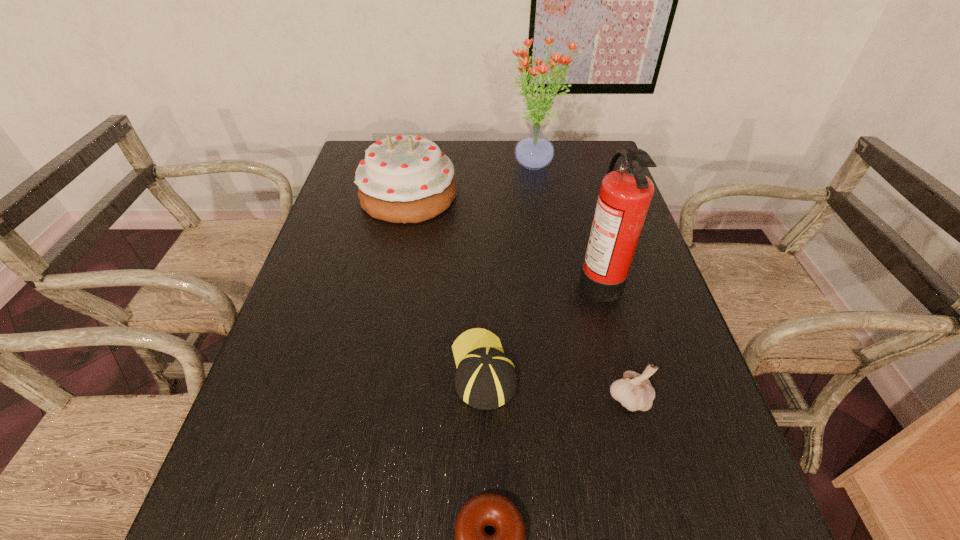
You are a GUI agent. You are given a task and a screenshot of the screen. Output one action in this format:
    pyautogui.click(x=<x>, y=<y>)
    Task: Click on the vacant region between the fourth shortest object and the flower arrangement
    
    Given the screenshot: What is the action you would take?
    pyautogui.click(x=472, y=180)

This screenshot has width=960, height=540. I want to click on free point between the baseball cap and the flower arrangement, so click(510, 267).

This screenshot has height=540, width=960. Identify the location of free area in between the baseball cap and the flower arrangement. (510, 267).

You are a GUI agent. You are given a task and a screenshot of the screen. Output one action in this format:
    pyautogui.click(x=<x>, y=<y>)
    Task: Click on the empty space between the leftmost object and the flower arrangement
    
    Given the screenshot: What is the action you would take?
    pyautogui.click(x=472, y=180)

Identify which object is located as the fifth nearest to the fourth tallest object. Please provide its 2D coordinates. Your answer should be formatted as a tuple, i.e. [(x, y)], where the tuple contains the x and y coordinates of a point satisfying the conditions above.

[(534, 151)]

Point out which object is positioned as the second nearest to the fourth nearest object. Please provide its 2D coordinates. Your answer should be formatted as a tuple, i.e. [(x, y)], where the tuple contains the x and y coordinates of a point satisfying the conditions above.

[(635, 392)]

The width and height of the screenshot is (960, 540). Identify the location of free spot that satisfies the following two spatial constraints: 1. on the front-facing side of the fire extinguisher; 2. on the front side of the fourth tallest object. (631, 398).

The image size is (960, 540). I want to click on blank space that satisfies the following two spatial constraints: 1. on the front-facing side of the fourth nearest object; 2. on the front side of the garlic, so click(631, 398).

Identify the location of free spot that satisfies the following two spatial constraints: 1. on the front side of the third shortest object; 2. on the right side of the leftmost object. The width and height of the screenshot is (960, 540). (368, 398).

The width and height of the screenshot is (960, 540). What are the coordinates of `free spot that satisfies the following two spatial constraints: 1. with the brim of the baseball cap facing forward; 2. on the right side of the flower arrangement` in the screenshot? It's located at (482, 165).